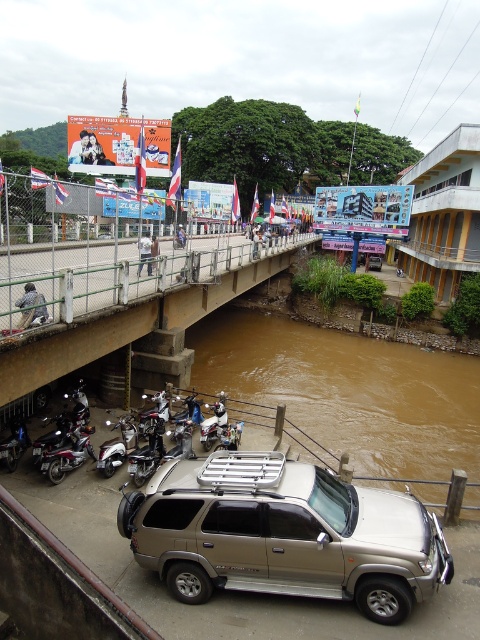
You are a pedestrian standing on the brown concrete bridge at lower left and want to cross to the other side. The silver metallic suv at center is blocking your path. Can you walk around it to continue your journey?

The silver metallic suv at center is in front of the brown concrete bridge at lower left, so you can walk around it on either side to continue crossing the bridge.

You are a pedestrian trying to cross the bridge over the brown muddy water at lower center and the brown concrete bridge at lower left. Which object is located lower in the image?

The brown muddy water at lower center is located lower in the image than the brown concrete bridge at lower left.